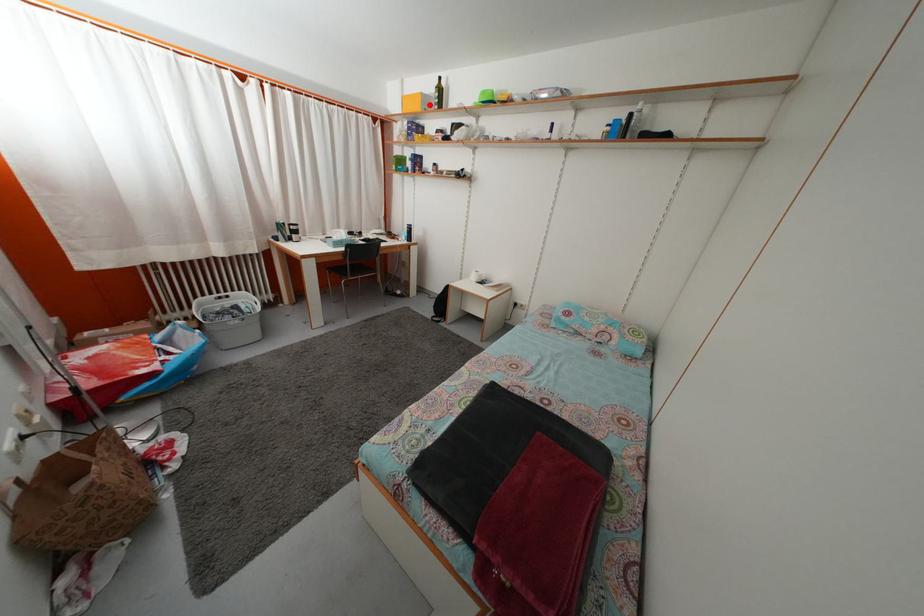
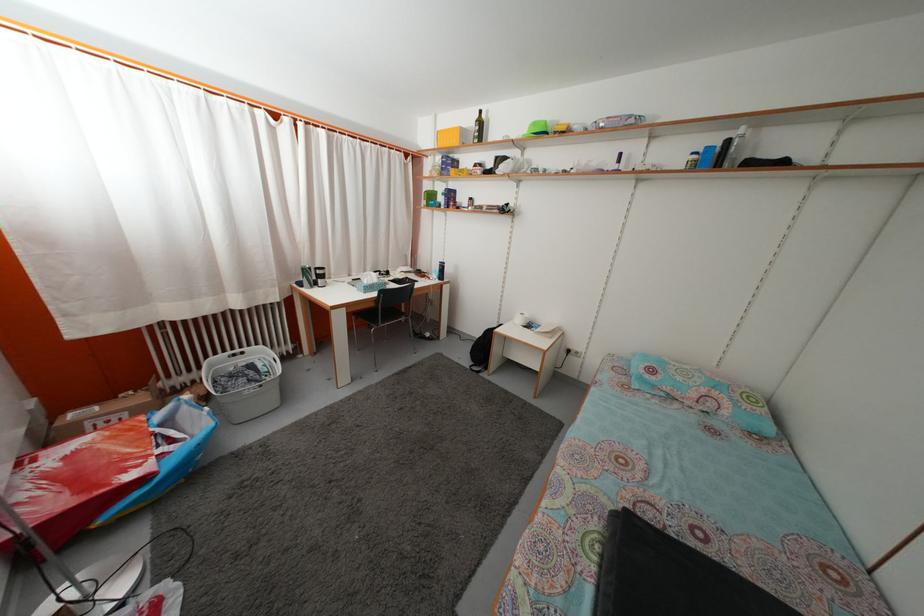
Find the pixel in the second image that matches the highlighted location in the first image.

(468, 139)